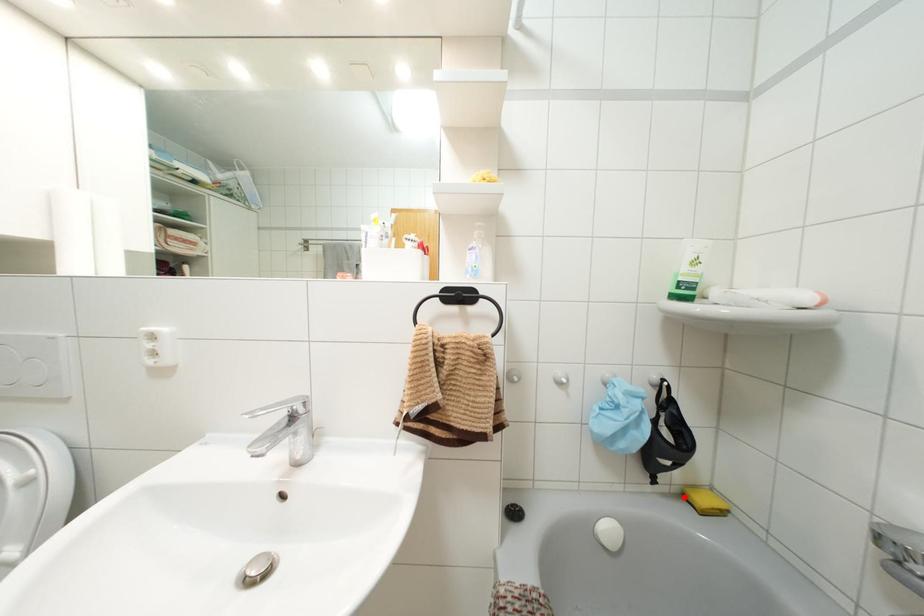
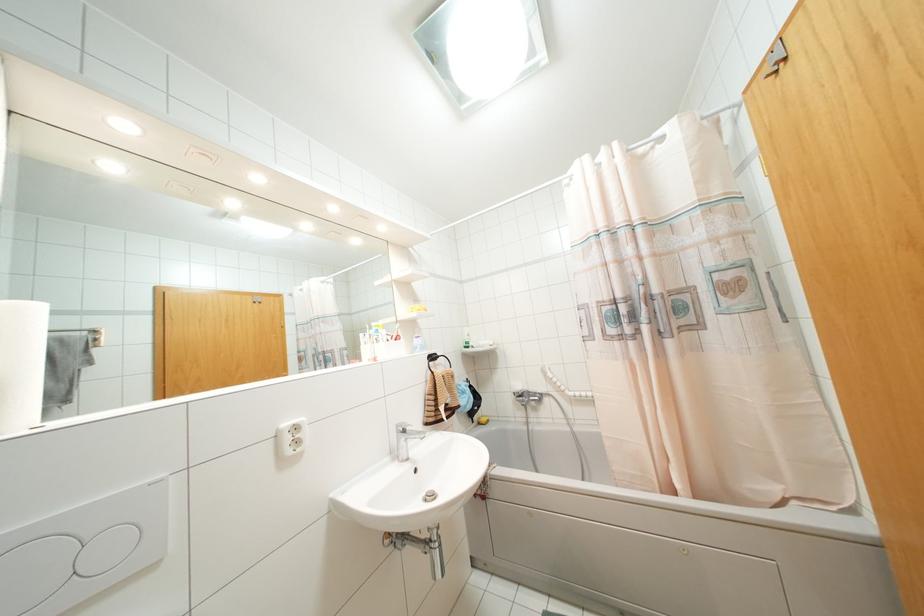
In the second image, find the point that corresponds to the highlighted location in the first image.

(479, 423)